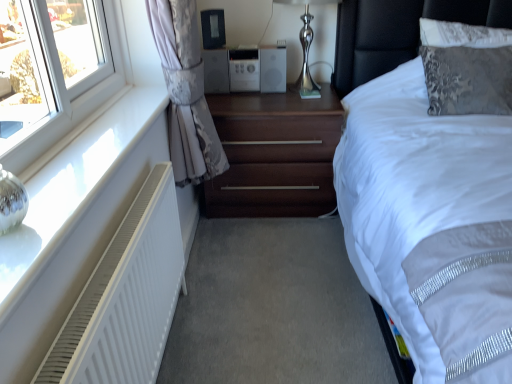
Image resolution: width=512 pixels, height=384 pixels. In order to click on free point below silky gray curtain at left (from a real-world perspective) in this screenshot , I will do `click(209, 257)`.